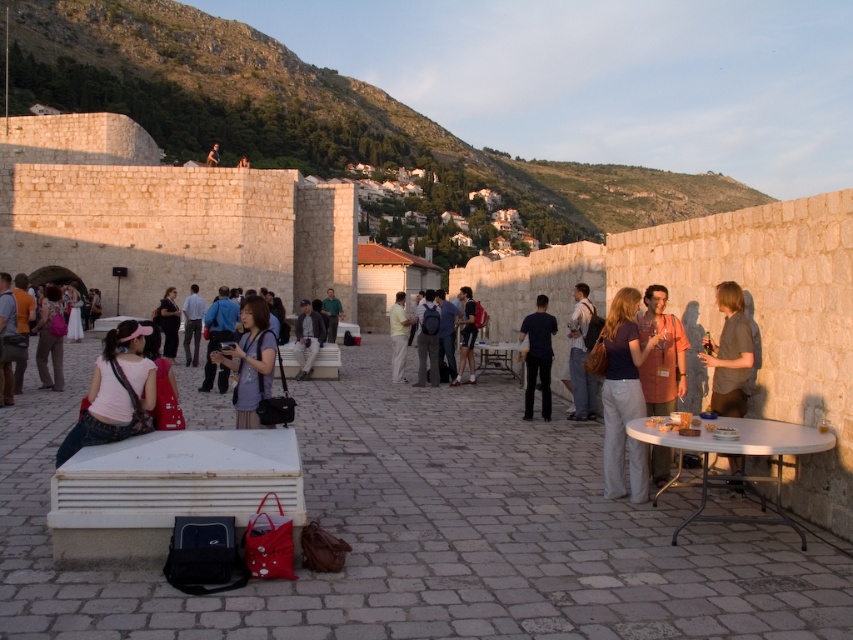
Question: Where is dark blue shirt at center located in relation to matte gray pants at center in the image?

Choices:
 (A) left
 (B) right

Answer: (B)

Question: Which point is closer to the camera taking this photo?

Choices:
 (A) (247, 388)
 (B) (576, 419)
 (C) (392, 314)
 (D) (619, 449)

Answer: (D)

Question: Is dark blue shirt at center bigger than dark blue backpack at center?

Choices:
 (A) yes
 (B) no

Answer: (A)

Question: Which point is farther to the camera?

Choices:
 (A) orange fabric shirt at center
 (B) matte gray pants at center
 (C) matte pink shirt at center

Answer: (B)

Question: Estimate the real-world distances between objects in this image. Which object is closer to the matte purple shirt at center?

Choices:
 (A) green fabric shirt at center
 (B) denim jacket at center

Answer: (B)

Question: Does brown cotton shirt at right appear on the right side of matte pink shirt at center?

Choices:
 (A) no
 (B) yes

Answer: (B)